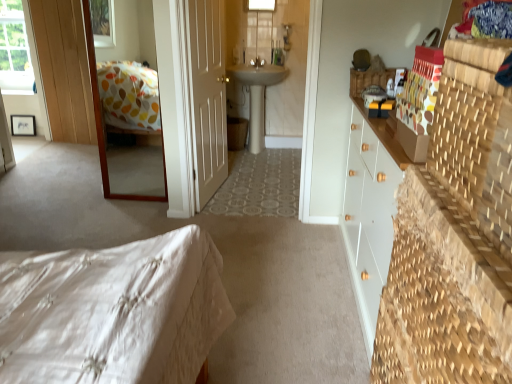
This screenshot has height=384, width=512. In order to click on free spot in front of white ceramic sink at center in this screenshot , I will do `click(259, 170)`.